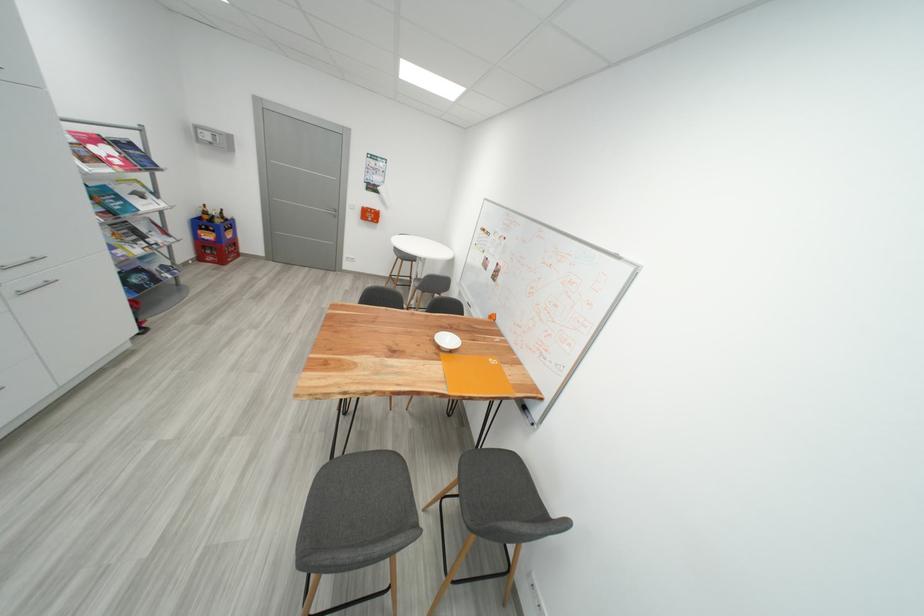
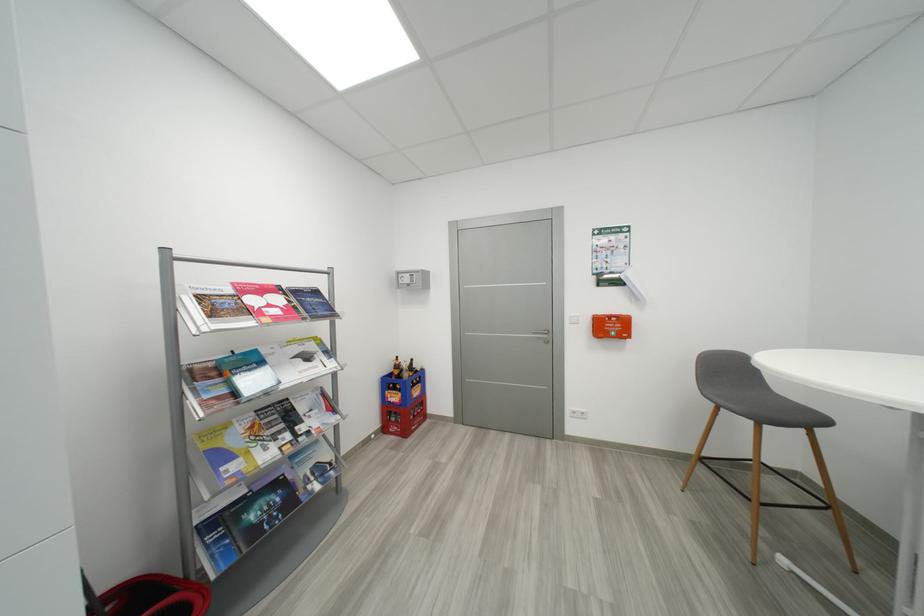
Find the pixel in the second image that matches (x=149, y=198) in the first image.

(314, 359)